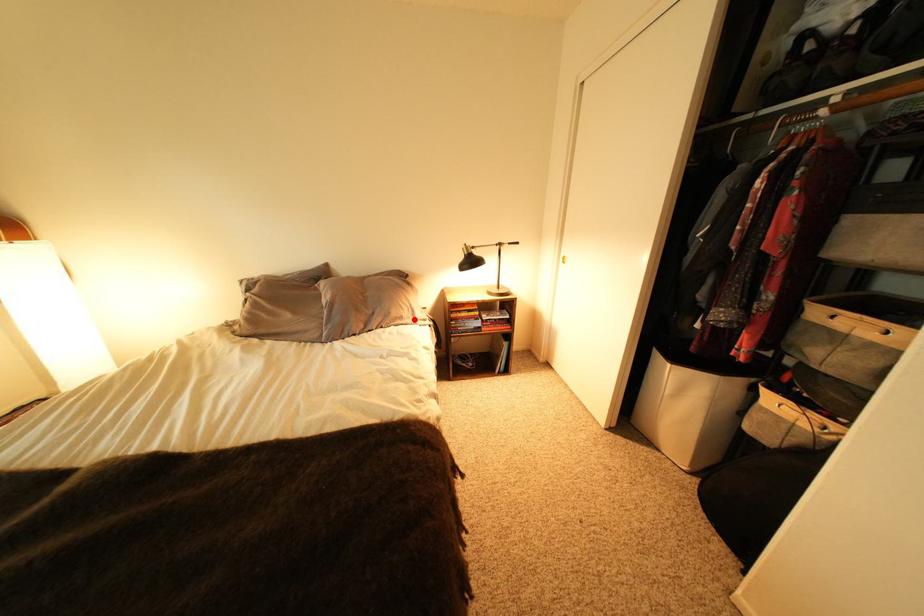
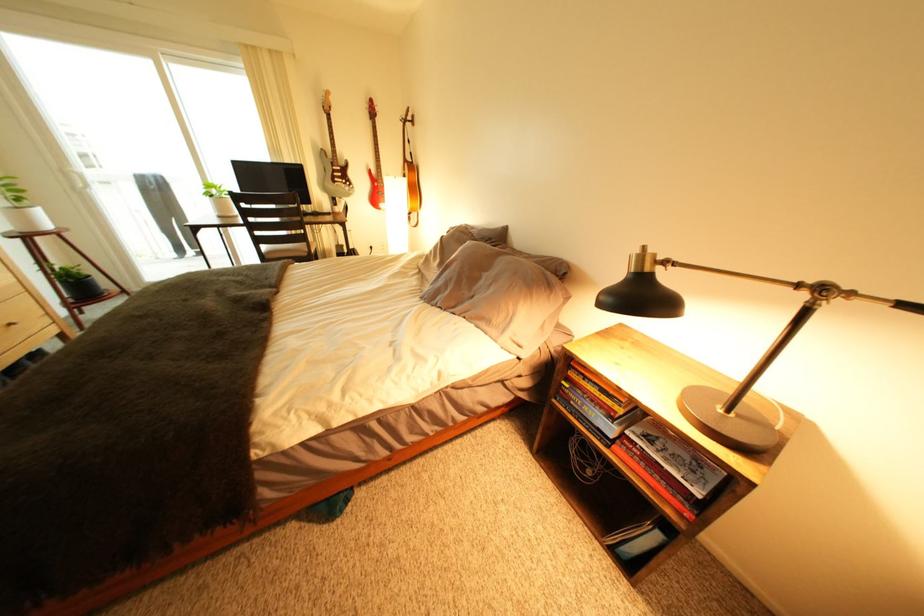
In the second image, find the point that corresponds to the highlighted location in the first image.

(503, 323)